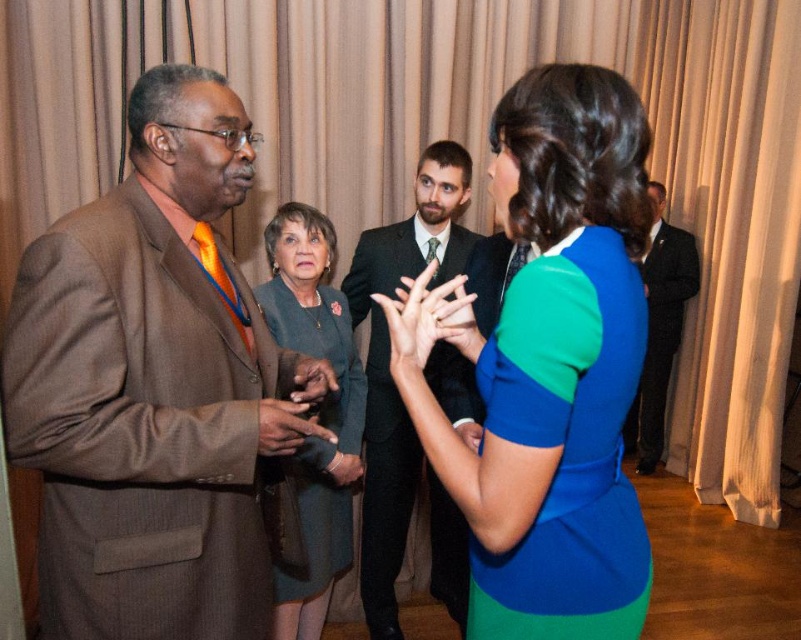
Question: Based on their relative distances, which object is nearer to the brown leather glove at center?

Choices:
 (A) matte brown leather wallet at center
 (B) green fabric hand at center

Answer: (A)

Question: Estimate the real-world distances between objects in this image. Which object is closer to the green matte dress at center?

Choices:
 (A) brown pinstripe suit at left
 (B) brown leather glove at center
 (C) matte brown leather wallet at center
 (D) blue-green fabric dress at center

Answer: (D)

Question: Does blue-green fabric dress at center lie in front of green matte dress at center?

Choices:
 (A) no
 (B) yes

Answer: (B)

Question: Where is teal fabric dress at center located in relation to matte brown leather wallet at center in the image?

Choices:
 (A) above
 (B) below

Answer: (B)

Question: Which is farther from the matte brown suit at center?

Choices:
 (A) brown leather glove at center
 (B) blue-green fabric dress at center
 (C) green fabric hand at center

Answer: (B)

Question: Can you confirm if blue-green fabric dress at center is positioned to the left of matte brown suit at center?

Choices:
 (A) no
 (B) yes

Answer: (A)